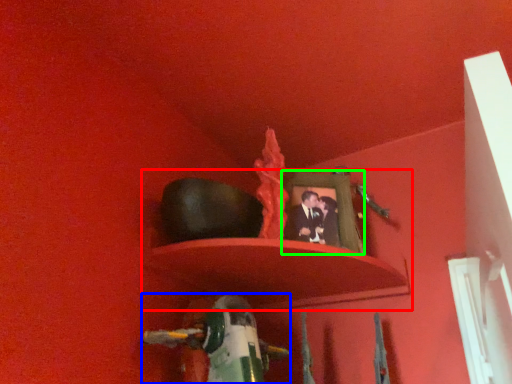
Question: Which object is positioned farthest from shelf (highlighted by a red box)? Select from toy (highlighted by a blue box) and picture frame (highlighted by a green box).

Choices:
 (A) toy
 (B) picture frame

Answer: (A)